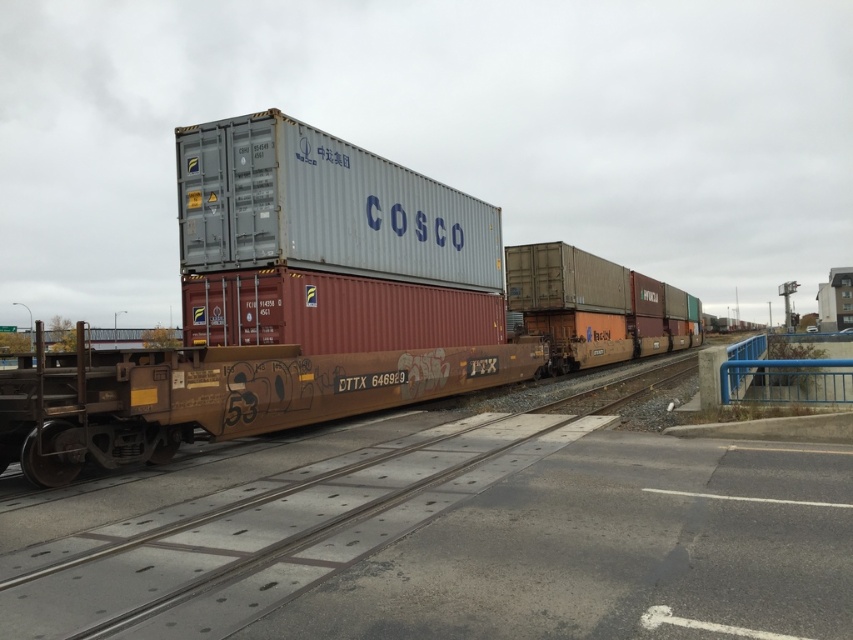
Question: Which point is farther to the camera?

Choices:
 (A) (422, 472)
 (B) (341, 225)

Answer: (B)

Question: Considering the relative positions of metallic gray container at center and rusty metal train track at center in the image provided, where is metallic gray container at center located with respect to rusty metal train track at center?

Choices:
 (A) above
 (B) below

Answer: (A)

Question: Which object is farther from the camera taking this photo?

Choices:
 (A) rusty metal train track at center
 (B) metallic gray container at center

Answer: (B)

Question: Does metallic gray container at center have a smaller size compared to rusty metal train track at center?

Choices:
 (A) yes
 (B) no

Answer: (B)

Question: Is metallic gray container at center above rusty metal train track at center?

Choices:
 (A) yes
 (B) no

Answer: (A)

Question: Which of the following is the farthest from the observer?

Choices:
 (A) (61, 476)
 (B) (495, 472)

Answer: (B)